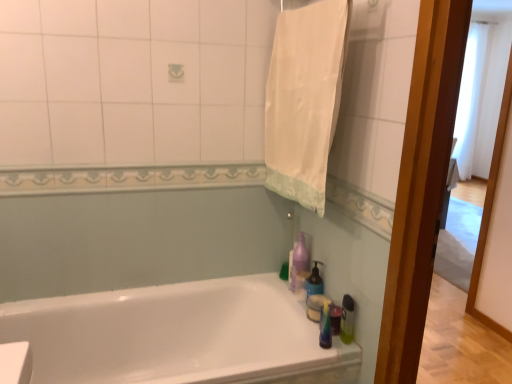
Question: From the image's perspective, is purple glossy bottle at upper right, which is the third cleaning product in front-to-back order, beneath white cotton towel at upper right?

Choices:
 (A) no
 (B) yes

Answer: (B)

Question: Can you see purple glossy bottle at upper right, which is the third cleaning product in front-to-back order, touching white cotton towel at upper right?

Choices:
 (A) yes
 (B) no

Answer: (B)

Question: Is purple glossy bottle at upper right, the first cleaning product in the back-to-front sequence, taller than white cotton towel at upper right?

Choices:
 (A) no
 (B) yes

Answer: (A)

Question: Does purple glossy bottle at upper right, which is the third cleaning product in front-to-back order, have a smaller size compared to white cotton towel at upper right?

Choices:
 (A) yes
 (B) no

Answer: (A)

Question: From a real-world perspective, is purple glossy bottle at upper right, the first cleaning product in the back-to-front sequence, under white cotton towel at upper right?

Choices:
 (A) yes
 (B) no

Answer: (A)

Question: From a real-world perspective, relative to white glossy bathtub at lower center, is translucent plastic soap dispenser at right, arranged as the second cleaning product when viewed from the front, vertically above or below?

Choices:
 (A) above
 (B) below

Answer: (A)

Question: In terms of height, does translucent plastic soap dispenser at right, arranged as the second cleaning product when viewed from the front, look taller or shorter compared to white glossy bathtub at lower center?

Choices:
 (A) tall
 (B) short

Answer: (B)

Question: Looking at the image, does translucent plastic soap dispenser at right, arranged as the second cleaning product when viewed from the front, seem bigger or smaller compared to white glossy bathtub at lower center?

Choices:
 (A) small
 (B) big

Answer: (A)

Question: From the image's perspective, is translucent plastic soap dispenser at right, the 2th cleaning product when ordered from back to front, located above or below white glossy bathtub at lower center?

Choices:
 (A) below
 (B) above

Answer: (B)

Question: Would you say purple glossy bottle at upper right, the first cleaning product in the back-to-front sequence, is to the left or to the right of white glossy bathtub at lower center in the picture?

Choices:
 (A) right
 (B) left

Answer: (A)

Question: From the image's perspective, is purple glossy bottle at upper right, which is the third cleaning product in front-to-back order, positioned above or below white glossy bathtub at lower center?

Choices:
 (A) above
 (B) below

Answer: (A)

Question: Is purple glossy bottle at upper right, which is the third cleaning product in front-to-back order, bigger or smaller than white glossy bathtub at lower center?

Choices:
 (A) small
 (B) big

Answer: (A)

Question: Is purple glossy bottle at upper right, which is the third cleaning product in front-to-back order, in front of or behind white glossy bathtub at lower center in the image?

Choices:
 (A) front
 (B) behind

Answer: (B)

Question: Based on their sizes in the image, would you say white glossy bathtub at lower center is bigger or smaller than translucent plastic soap dispenser at right, the 2th cleaning product when ordered from back to front?

Choices:
 (A) big
 (B) small

Answer: (A)

Question: Is white glossy bathtub at lower center wider or thinner than translucent plastic soap dispenser at right, the 2th cleaning product when ordered from back to front?

Choices:
 (A) thin
 (B) wide

Answer: (B)